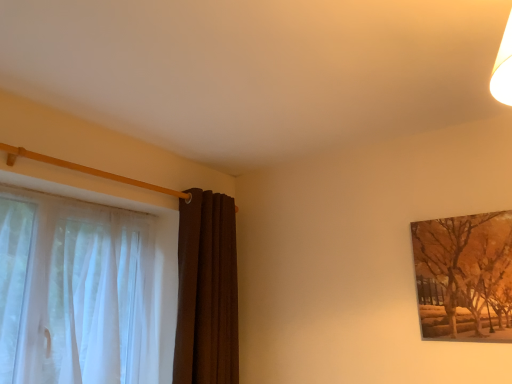
What do you see at coordinates (465, 277) in the screenshot?
I see `brown textured painting at upper right` at bounding box center [465, 277].

I want to click on brown velvet curtain at left, positioned as the 2th curtain in left-to-right order, so click(207, 291).

The width and height of the screenshot is (512, 384). Find the location of `sheer white curtain at left, the second curtain when ordered from right to left`. sheer white curtain at left, the second curtain when ordered from right to left is located at coordinates (73, 291).

From the image's perspective, relative to sheer white curtain at left, the second curtain when ordered from right to left, is brown textured painting at upper right above or below?

From the image's perspective, brown textured painting at upper right appears above sheer white curtain at left, the second curtain when ordered from right to left.

Which curtain is the 2nd one when counting from the left side of the brown textured painting at upper right? Please provide its 2D coordinates.

[(73, 291)]

Can you tell me how much brown textured painting at upper right and sheer white curtain at left, the second curtain when ordered from right to left, differ in facing direction?

The angular difference between brown textured painting at upper right and sheer white curtain at left, the second curtain when ordered from right to left, is 90.1 degrees.

Considering the sizes of objects brown textured painting at upper right and sheer white curtain at left, the second curtain when ordered from right to left, in the image provided, who is taller, brown textured painting at upper right or sheer white curtain at left, the second curtain when ordered from right to left,?

Standing taller between the two is sheer white curtain at left, the second curtain when ordered from right to left.

Based on their sizes in the image, would you say sheer white curtain at left, the second curtain when ordered from right to left, is bigger or smaller than brown textured painting at upper right?

Considering their sizes, sheer white curtain at left, the second curtain when ordered from right to left, takes up more space than brown textured painting at upper right.

Which of these two, sheer white curtain at left, positioned as the first curtain in left-to-right order, or brown textured painting at upper right, is wider?

With larger width is sheer white curtain at left, positioned as the first curtain in left-to-right order.

Does sheer white curtain at left, the second curtain when ordered from right to left, lie behind brown textured painting at upper right?

That is False.

Is sheer white curtain at left, the second curtain when ordered from right to left, aimed at brown textured painting at upper right?

Yes, sheer white curtain at left, the second curtain when ordered from right to left, is aimed at brown textured painting at upper right.

Do you think brown velvet curtain at left, positioned as the 2th curtain in left-to-right order, is within brown textured painting at upper right, or outside of it?

brown velvet curtain at left, positioned as the 2th curtain in left-to-right order, lies outside brown textured painting at upper right.

Does brown velvet curtain at left, the first curtain positioned from the right, have a greater height compared to brown textured painting at upper right?

Correct, brown velvet curtain at left, the first curtain positioned from the right, is much taller as brown textured painting at upper right.

How much distance is there between brown velvet curtain at left, the first curtain positioned from the right, and brown textured painting at upper right?

brown velvet curtain at left, the first curtain positioned from the right, and brown textured painting at upper right are 3.67 feet apart from each other.

Which is more to the right, brown velvet curtain at left, positioned as the 2th curtain in left-to-right order, or brown textured painting at upper right?

From the viewer's perspective, brown textured painting at upper right appears more on the right side.

Based on the photo, from the image's perspective, which object appears higher, brown velvet curtain at left, the first curtain positioned from the right, or sheer white curtain at left, the second curtain when ordered from right to left?

From the image's view, sheer white curtain at left, the second curtain when ordered from right to left, is above.

Is brown velvet curtain at left, the first curtain positioned from the right, thinner than sheer white curtain at left, the second curtain when ordered from right to left?

Indeed, brown velvet curtain at left, the first curtain positioned from the right, has a lesser width compared to sheer white curtain at left, the second curtain when ordered from right to left.

Find the location of a particular element. curtain beneath the brown velvet curtain at left, positioned as the 2th curtain in left-to-right order (from a real-world perspective) is located at coordinates (73, 291).

Is brown velvet curtain at left, the first curtain positioned from the right, not near sheer white curtain at left, the second curtain when ordered from right to left?

No, brown velvet curtain at left, the first curtain positioned from the right, is in close proximity to sheer white curtain at left, the second curtain when ordered from right to left.

Is brown textured painting at upper right wider than brown velvet curtain at left, positioned as the 2th curtain in left-to-right order?

Incorrect, the width of brown textured painting at upper right does not surpass that of brown velvet curtain at left, positioned as the 2th curtain in left-to-right order.

Does brown textured painting at upper right turn towards brown velvet curtain at left, the first curtain positioned from the right?

No, brown textured painting at upper right is not turned towards brown velvet curtain at left, the first curtain positioned from the right.

Is the depth of brown textured painting at upper right greater than that of brown velvet curtain at left, the first curtain positioned from the right?

No, it is not.

Are brown textured painting at upper right and brown velvet curtain at left, the first curtain positioned from the right, located far from each other?

Indeed, brown textured painting at upper right is not near brown velvet curtain at left, the first curtain positioned from the right.

Can you confirm if sheer white curtain at left, the second curtain when ordered from right to left, is wider than brown velvet curtain at left, positioned as the 2th curtain in left-to-right order?

Correct, the width of sheer white curtain at left, the second curtain when ordered from right to left, exceeds that of brown velvet curtain at left, positioned as the 2th curtain in left-to-right order.

From a real-world perspective, is sheer white curtain at left, the second curtain when ordered from right to left, located beneath brown velvet curtain at left, the first curtain positioned from the right?

Yes.

Locate an element on the screen. The image size is (512, 384). curtain located underneath the brown velvet curtain at left, positioned as the 2th curtain in left-to-right order (from a real-world perspective) is located at coordinates (73, 291).

This screenshot has width=512, height=384. In order to click on tree that appears above the sheer white curtain at left, positioned as the first curtain in left-to-right order (from a real-world perspective) in this screenshot , I will do `click(465, 277)`.

Find the location of a particular element. This screenshot has width=512, height=384. the 1st curtain below the brown textured painting at upper right (from the image's perspective) is located at coordinates (73, 291).

Which object lies further to the anchor point sheer white curtain at left, positioned as the first curtain in left-to-right order, brown textured painting at upper right or brown velvet curtain at left, positioned as the 2th curtain in left-to-right order?

brown textured painting at upper right is positioned further to the anchor sheer white curtain at left, positioned as the first curtain in left-to-right order.

Estimate the real-world distances between objects in this image. Which object is further from brown velvet curtain at left, the first curtain positioned from the right, sheer white curtain at left, positioned as the first curtain in left-to-right order, or brown textured painting at upper right?

brown textured painting at upper right.

In the scene shown: Looking at the image, which one is located further to brown textured painting at upper right, brown velvet curtain at left, positioned as the 2th curtain in left-to-right order, or sheer white curtain at left, positioned as the first curtain in left-to-right order?

sheer white curtain at left, positioned as the first curtain in left-to-right order.

Considering their positions, is brown velvet curtain at left, the first curtain positioned from the right, positioned further to sheer white curtain at left, positioned as the first curtain in left-to-right order, than brown textured painting at upper right?

The object further to sheer white curtain at left, positioned as the first curtain in left-to-right order, is brown textured painting at upper right.

Considering their positions, is brown textured painting at upper right positioned closer to brown velvet curtain at left, positioned as the 2th curtain in left-to-right order, than sheer white curtain at left, the second curtain when ordered from right to left?

sheer white curtain at left, the second curtain when ordered from right to left, is positioned closer to the anchor brown velvet curtain at left, positioned as the 2th curtain in left-to-right order.

When comparing their distances from brown textured painting at upper right, does sheer white curtain at left, the second curtain when ordered from right to left, or brown velvet curtain at left, positioned as the 2th curtain in left-to-right order, seem further?

sheer white curtain at left, the second curtain when ordered from right to left, is positioned further to the anchor brown textured painting at upper right.

Locate an element on the screen. curtain between sheer white curtain at left, the second curtain when ordered from right to left, and brown textured painting at upper right, in the horizontal direction is located at coordinates (207, 291).